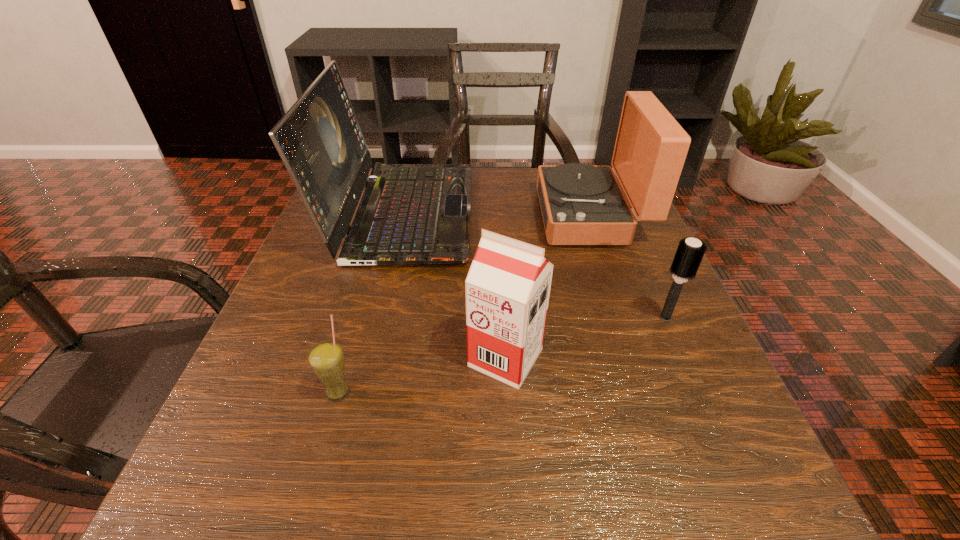
The height and width of the screenshot is (540, 960). What are the coordinates of `laptop computer` in the screenshot? It's located at (410, 214).

At what (x,y) coordinates should I click in order to perform the action: click on phonograph record. Please return your answer as a coordinate pair (x, y). The height and width of the screenshot is (540, 960). Looking at the image, I should click on (581, 204).

In order to click on soya milk in this screenshot , I will do `click(507, 288)`.

At what (x,y) coordinates should I click in order to perform the action: click on the third nearest object. Please return your answer as a coordinate pair (x, y). Looking at the image, I should click on (690, 252).

Locate an element on the screen. The image size is (960, 540). straw for drinking is located at coordinates (326, 359).

This screenshot has height=540, width=960. In order to click on free location located 0.170m on the screen of the laptop computer in this screenshot , I will do `click(546, 213)`.

Find the location of a particular element. This screenshot has height=540, width=960. free space located on the face of the phonograph record is located at coordinates (465, 215).

Where is `vacant space located 0.050m on the face of the phonograph record`? This screenshot has height=540, width=960. vacant space located 0.050m on the face of the phonograph record is located at coordinates (518, 215).

Locate an element on the screen. Image resolution: width=960 pixels, height=540 pixels. vacant area situated 0.210m on the face of the phonograph record is located at coordinates (446, 215).

Where is `vacant space located 0.220m on the left of the soya milk`? Image resolution: width=960 pixels, height=540 pixels. vacant space located 0.220m on the left of the soya milk is located at coordinates (325, 357).